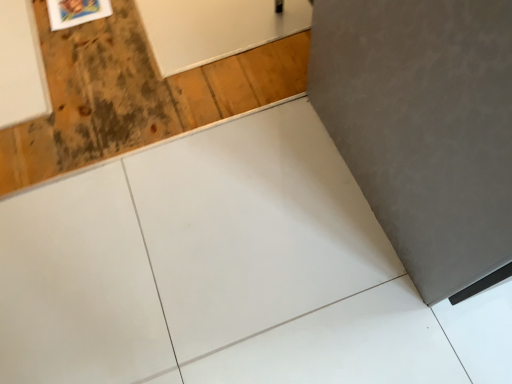
Question: Is wooden frame at upper left facing away from wooden plywood at upper left?

Choices:
 (A) no
 (B) yes

Answer: (B)

Question: From a real-world perspective, is wooden frame at upper left located beneath wooden plywood at upper left?

Choices:
 (A) no
 (B) yes

Answer: (B)

Question: Does wooden frame at upper left have a greater height compared to wooden plywood at upper left?

Choices:
 (A) yes
 (B) no

Answer: (A)

Question: Is there a large distance between wooden frame at upper left and wooden plywood at upper left?

Choices:
 (A) no
 (B) yes

Answer: (A)

Question: From the image's perspective, is wooden frame at upper left on wooden plywood at upper left?

Choices:
 (A) yes
 (B) no

Answer: (A)

Question: Could you tell me if wooden frame at upper left is turned towards wooden plywood at upper left?

Choices:
 (A) no
 (B) yes

Answer: (B)

Question: Is wooden plywood at upper left facing away from wooden frame at upper left?

Choices:
 (A) no
 (B) yes

Answer: (B)

Question: Is wooden frame at upper left located within wooden plywood at upper left?

Choices:
 (A) yes
 (B) no

Answer: (A)

Question: From the image's perspective, is wooden plywood at upper left below wooden frame at upper left?

Choices:
 (A) yes
 (B) no

Answer: (A)

Question: Can you confirm if wooden plywood at upper left is shorter than wooden frame at upper left?

Choices:
 (A) no
 (B) yes

Answer: (B)

Question: Considering the relative sizes of wooden plywood at upper left and wooden frame at upper left in the image provided, is wooden plywood at upper left bigger than wooden frame at upper left?

Choices:
 (A) yes
 (B) no

Answer: (A)

Question: Is wooden plywood at upper left behind wooden frame at upper left?

Choices:
 (A) no
 (B) yes

Answer: (A)

Question: From the image's perspective, is wooden plywood at upper left positioned above or below wooden frame at upper left?

Choices:
 (A) above
 (B) below

Answer: (B)